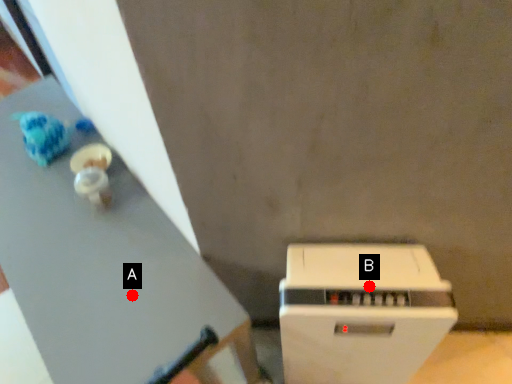
Question: Two points are circled on the image, labeled by A and B beside each circle. Which of the following is the farthest from the observer?

Choices:
 (A) A is further
 (B) B is further

Answer: (A)